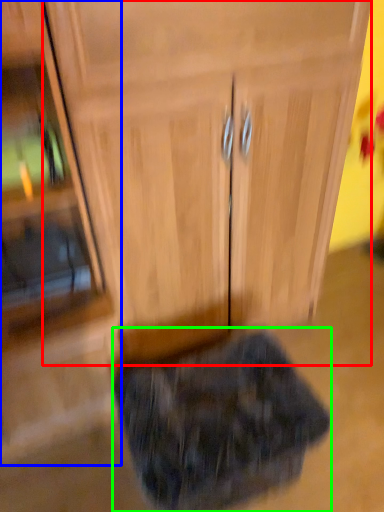
Question: Estimate the real-world distances between objects in this image. Which object is closer to cabinetry (highlighted by a red box), side cabinet (highlighted by a blue box) or animal (highlighted by a green box)?

Choices:
 (A) side cabinet
 (B) animal

Answer: (A)